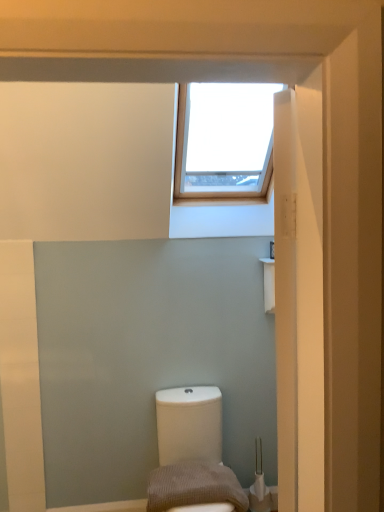
Question: Relative to brown textured pillow at lower center, is white glossy toilet at lower center in front or behind?

Choices:
 (A) behind
 (B) front

Answer: (B)

Question: Is point (170, 394) closer or farther from the camera than point (241, 495)?

Choices:
 (A) closer
 (B) farther

Answer: (B)

Question: In terms of size, does white glossy toilet at lower center appear bigger or smaller than brown textured pillow at lower center?

Choices:
 (A) big
 (B) small

Answer: (A)

Question: Is point (210, 488) closer or farther from the camera than point (193, 496)?

Choices:
 (A) closer
 (B) farther

Answer: (B)

Question: From a real-world perspective, relative to white glossy toilet at lower center, is brown textured pillow at lower center vertically above or below?

Choices:
 (A) below
 (B) above

Answer: (B)

Question: Visually, is brown textured pillow at lower center positioned to the left or to the right of white glossy toilet at lower center?

Choices:
 (A) left
 (B) right

Answer: (A)

Question: Considering their positions, is brown textured pillow at lower center located in front of or behind white glossy toilet at lower center?

Choices:
 (A) front
 (B) behind

Answer: (B)